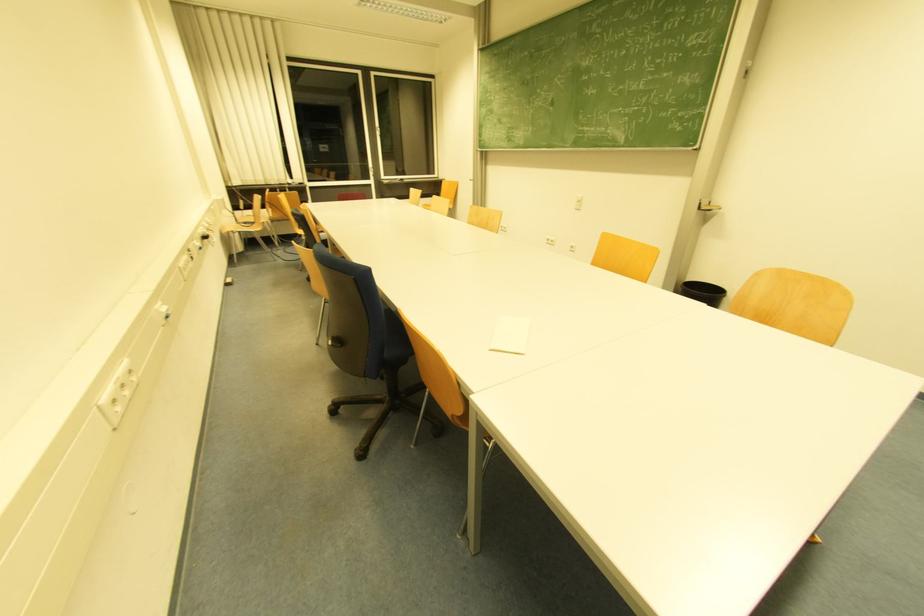
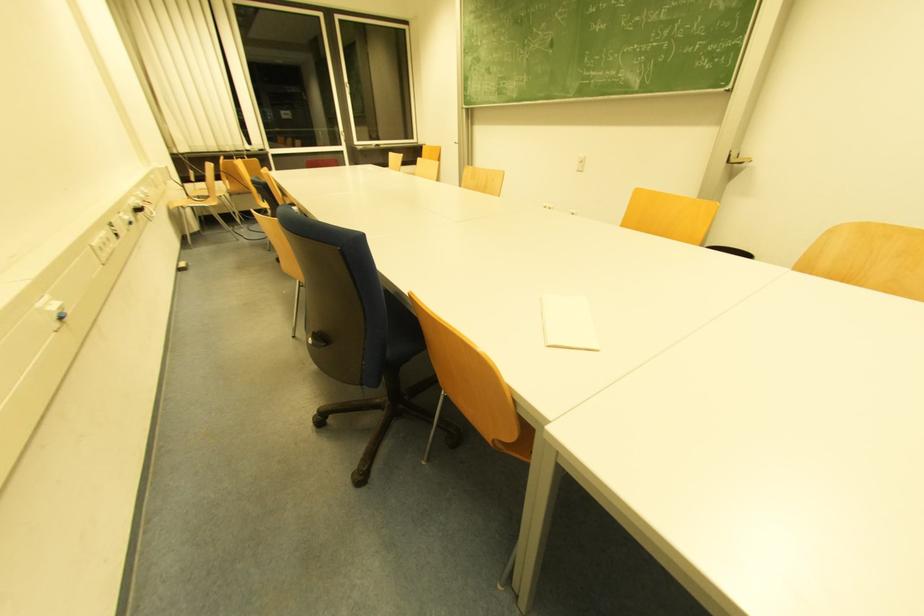
Question: The images are taken continuously from a first-person perspective. In which direction is your viewpoint rotating?

Choices:
 (A) Left
 (B) Right
 (C) Up
 (D) Down

Answer: (D)